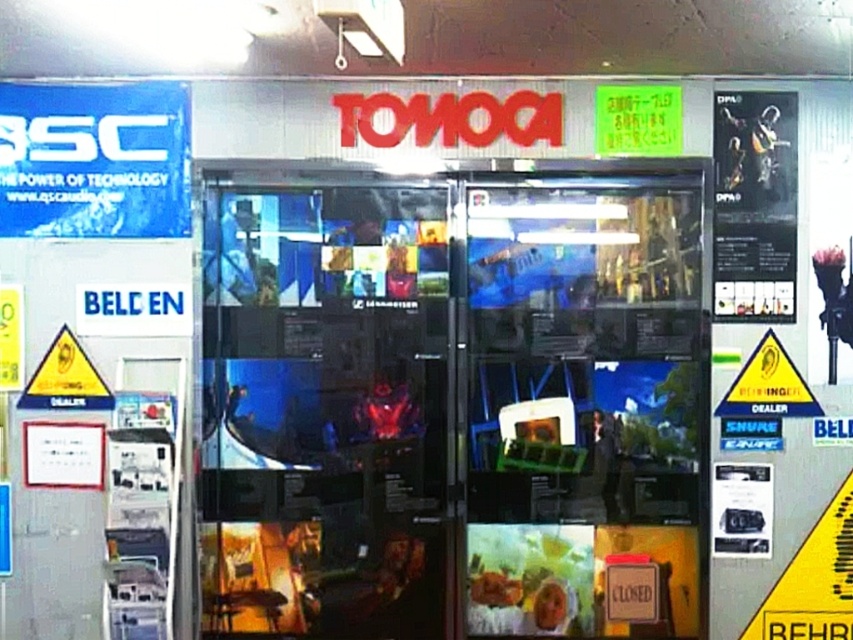
Is blue plastic sign at upper left wider than green plastic sign at upper center?

Yes, blue plastic sign at upper left is wider than green plastic sign at upper center.

Can you confirm if blue plastic sign at upper left is positioned to the right of green plastic sign at upper center?

In fact, blue plastic sign at upper left is to the left of green plastic sign at upper center.

Find the location of a particular element. The height and width of the screenshot is (640, 853). blue plastic sign at upper left is located at coordinates (94, 161).